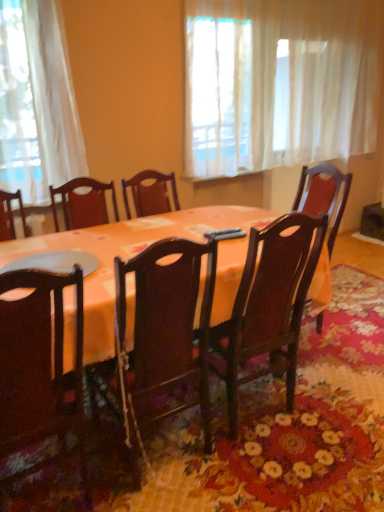
Question: Is black plastic remote control at center taller or shorter than orange fabric table at center?

Choices:
 (A) short
 (B) tall

Answer: (A)

Question: Is black plastic remote control at center bigger or smaller than orange fabric table at center?

Choices:
 (A) big
 (B) small

Answer: (B)

Question: Which object is the closest to the matte dark wood chair at lower left, the 1th chair viewed from the left?

Choices:
 (A) black plastic remote control at center
 (B) wooden chair at center, positioned as the second chair in left-to-right order
 (C) orange fabric table at center
 (D) white sheer curtain at upper center

Answer: (C)

Question: Estimate the real-world distances between objects in this image. Which object is closer to the orange fabric table at center?

Choices:
 (A) black plastic remote control at center
 (B) matte dark wood chair at lower left, the second chair in the right-to-left sequence
 (C) wooden chair at center, which ranks as the 1th chair in right-to-left order
 (D) white sheer curtain at upper center

Answer: (C)